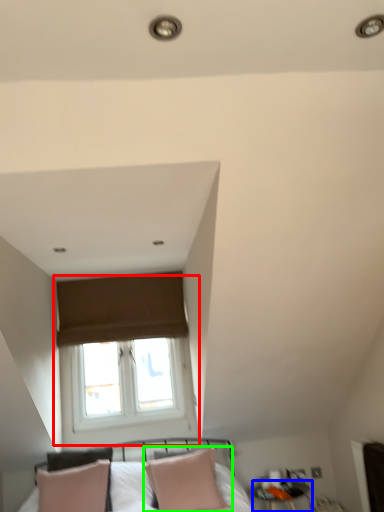
Question: Which object is positioned closest to window (highlighted by a red box)? Select from side table (highlighted by a blue box) and pillow (highlighted by a green box).

Choices:
 (A) side table
 (B) pillow

Answer: (B)